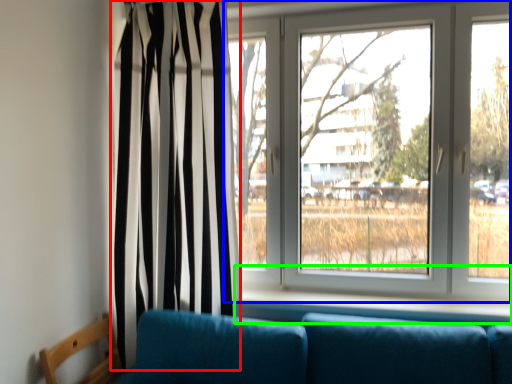
Question: Based on their relative distances, which object is nearer to curtain (highlighted by a red box)? Choose from window (highlighted by a blue box) and window sill (highlighted by a green box).

Choices:
 (A) window
 (B) window sill

Answer: (A)